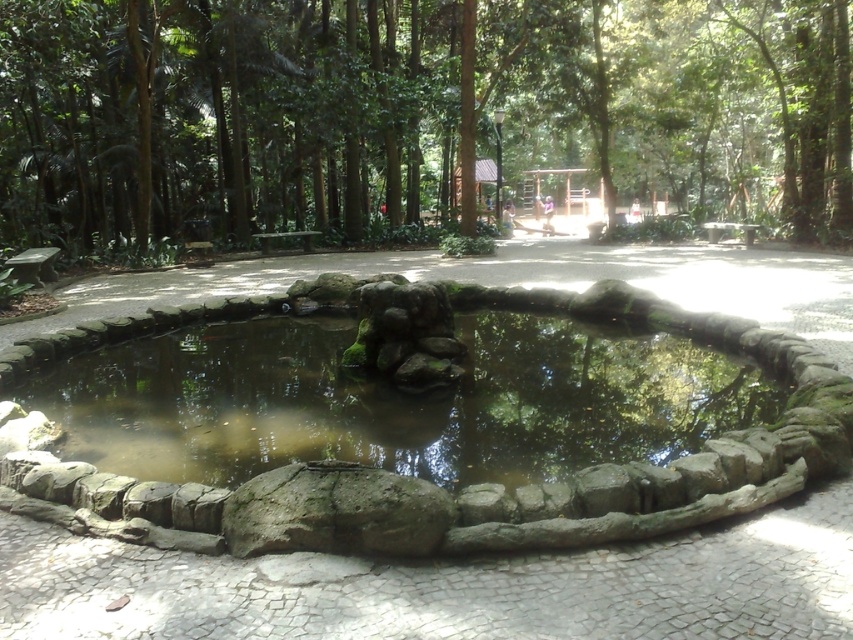
Question: Is green leafy tree at center to the right of clear water at pond center from the viewer's perspective?

Choices:
 (A) no
 (B) yes

Answer: (B)

Question: Among these objects, which one is farthest from the camera?

Choices:
 (A) clear water at pond center
 (B) green leafy tree at center

Answer: (B)

Question: Observing the image, what is the correct spatial positioning of green leafy tree at center in reference to clear water at pond center?

Choices:
 (A) below
 (B) above

Answer: (B)

Question: Can you confirm if green leafy tree at center is positioned below clear water at pond center?

Choices:
 (A) no
 (B) yes

Answer: (A)